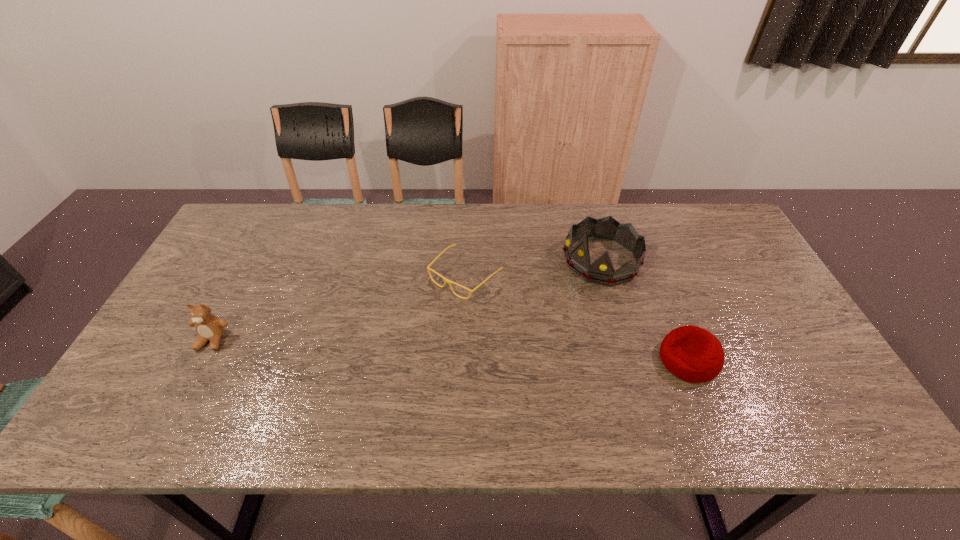
The width and height of the screenshot is (960, 540). In order to click on the leftmost object in this screenshot , I will do `click(210, 328)`.

The height and width of the screenshot is (540, 960). I want to click on the second tallest object, so click(210, 328).

I want to click on the second shortest object, so click(x=693, y=354).

Where is `tiara`? tiara is located at coordinates (601, 271).

You are a GUI agent. You are given a task and a screenshot of the screen. Output one action in this format:
    pyautogui.click(x=<x>, y=<y>)
    Task: Click on the third object from right to left
    
    Given the screenshot: What is the action you would take?
    pyautogui.click(x=449, y=282)

You are a GUI agent. You are given a task and a screenshot of the screen. Output one action in this format:
    pyautogui.click(x=<x>, y=<y>)
    Task: Click on the spectacles
    
    Given the screenshot: What is the action you would take?
    pyautogui.click(x=449, y=282)

This screenshot has height=540, width=960. Find the location of `free space located on the seat area of the third tallest object`. free space located on the seat area of the third tallest object is located at coordinates click(520, 360).

Locate an element on the screen. Image resolution: width=960 pixels, height=540 pixels. vacant position located 0.120m on the seat area of the third tallest object is located at coordinates (612, 360).

At what (x,y) coordinates should I click in order to perform the action: click on free space located on the seat area of the third tallest object. Please return your answer as a coordinate pair (x, y). The height and width of the screenshot is (540, 960). Looking at the image, I should click on (516, 360).

Locate an element on the screen. free spot located at the front of the tallest object with jewels is located at coordinates (508, 319).